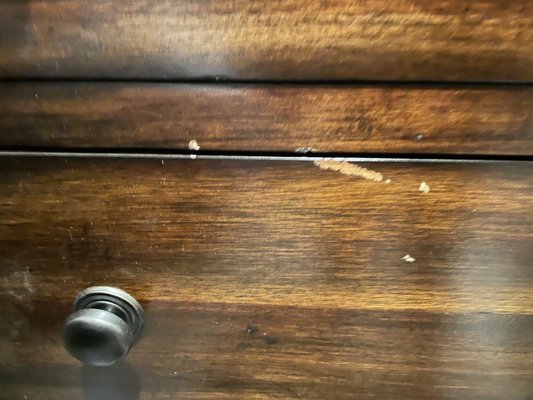
Find the location of `base of the door knob`. base of the door knob is located at coordinates (116, 297).